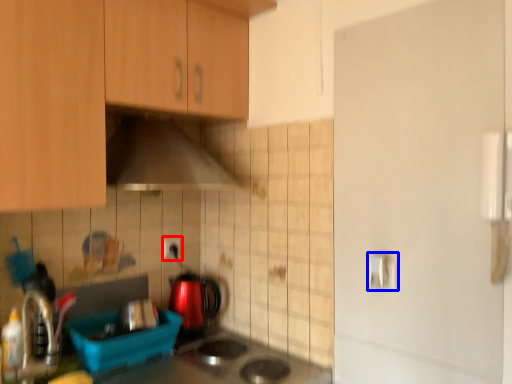
Question: Which point is further to the camera, electric outlet (highlighted by a red box) or door handle (highlighted by a blue box)?

Choices:
 (A) electric outlet
 (B) door handle

Answer: (A)